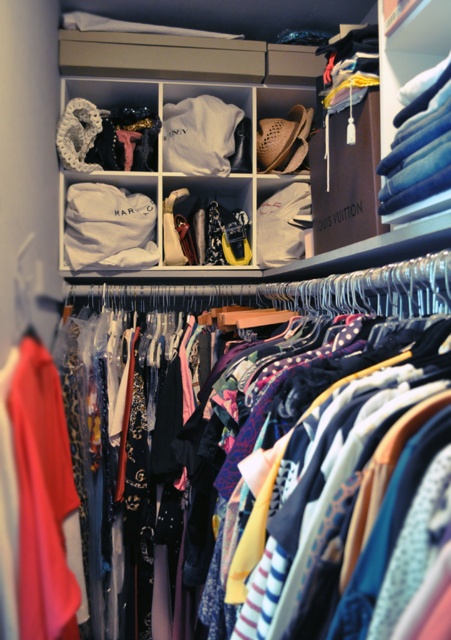
Question: In this image, where is white fabric at upper center located relative to denim jeans at upper right?

Choices:
 (A) above
 (B) below

Answer: (A)

Question: Is white fabric at upper center behind denim jeans at upper right?

Choices:
 (A) yes
 (B) no

Answer: (A)

Question: Which object appears farthest from the camera in this image?

Choices:
 (A) denim jeans at upper right
 (B) white fabric at upper center

Answer: (B)

Question: Based on their relative distances, which object is farther from the matte white shoes at center?

Choices:
 (A) denim jeans at upper right
 (B) white fabric at upper center

Answer: (A)

Question: Which object is positioned closest to the matte white shoes at center?

Choices:
 (A) white fabric at upper center
 (B) matte red dress at left
 (C) denim jeans at upper right

Answer: (A)

Question: Can you confirm if matte red dress at left is positioned below denim jeans at upper right?

Choices:
 (A) no
 (B) yes

Answer: (B)